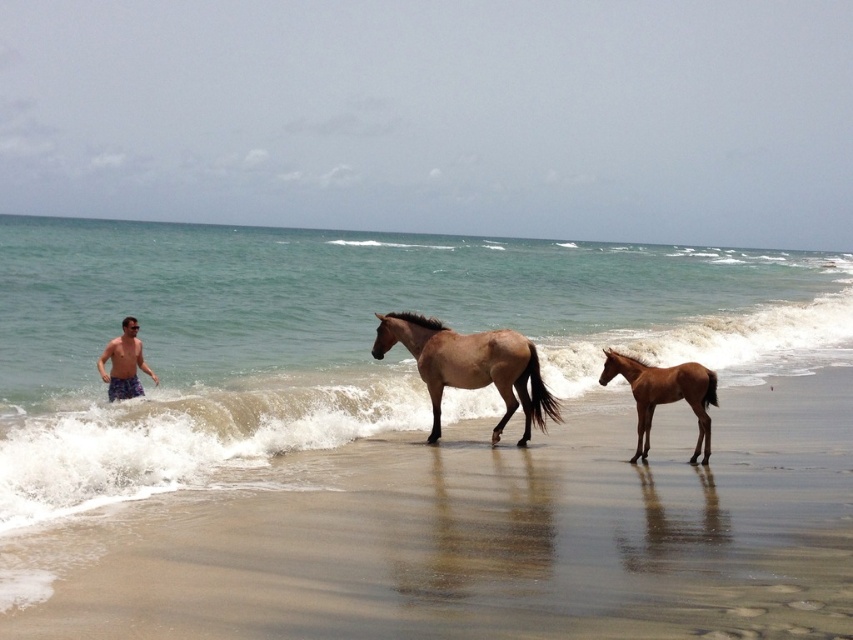
Is brown glossy horse at center bigger than brown glossy horse at lower right?

Yes, brown glossy horse at center is bigger than brown glossy horse at lower right.

You are a GUI agent. You are given a task and a screenshot of the screen. Output one action in this format:
    pyautogui.click(x=<x>, y=<y>)
    Task: Click on the brown glossy horse at center
    The image size is (853, 640).
    Given the screenshot: What is the action you would take?
    pyautogui.click(x=469, y=365)

Does brown sand at lower center have a larger size compared to brown glossy horse at center?

Indeed, brown sand at lower center has a larger size compared to brown glossy horse at center.

What do you see at coordinates (508, 538) in the screenshot?
I see `brown sand at lower center` at bounding box center [508, 538].

Locate an element on the screen. brown sand at lower center is located at coordinates (508, 538).

Locate an element on the screen. brown sand at lower center is located at coordinates (508, 538).

Between brown sand at lower center and brown glossy horse at lower right, which one is positioned higher?

brown glossy horse at lower right is above.

Is brown sand at lower center wider than brown glossy horse at lower right?

Yes, brown sand at lower center is wider than brown glossy horse at lower right.

Where is `brown sand at lower center`? The width and height of the screenshot is (853, 640). brown sand at lower center is located at coordinates (508, 538).

The width and height of the screenshot is (853, 640). Find the location of `brown sand at lower center`. brown sand at lower center is located at coordinates (508, 538).